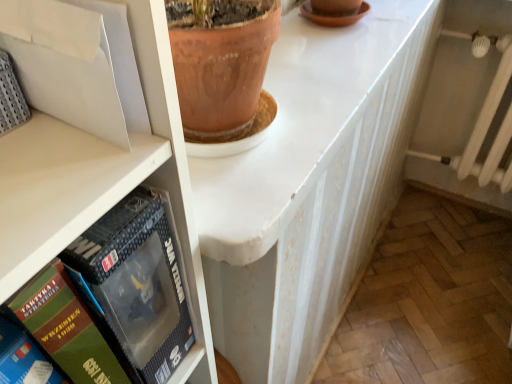
Identify the location of white glossy counter top at center. (294, 125).

The height and width of the screenshot is (384, 512). What do you see at coordinates (294, 125) in the screenshot?
I see `white glossy counter top at center` at bounding box center [294, 125].

Find the location of `green matte book at left, arranged as the 2th book when viewed from the left`. green matte book at left, arranged as the 2th book when viewed from the left is located at coordinates (64, 327).

Locate an element on the screen. green cardboard book at lower left, marked as the third book in a right-to-left arrangement is located at coordinates (23, 359).

Describe the element at coordinates (135, 285) in the screenshot. I see `matte black box at left, the first book viewed from the right` at that location.

Image resolution: width=512 pixels, height=384 pixels. What are the coordinates of `white glossy counter top at center` in the screenshot? It's located at (294, 125).

How many degrees apart are the facing directions of green matte book at left, the second book when ordered from right to left, and matte black box at left, which is the 3th book in left-to-right order?

2.6 degrees.

Is green matte book at left, the second book when ordered from right to left, in front of matte black box at left, which is the 3th book in left-to-right order?

Yes, green matte book at left, the second book when ordered from right to left, is closer to the camera.

Locate an element on the screen. Image resolution: width=512 pixels, height=384 pixels. the 1st book above the matte black box at left, which is the 3th book in left-to-right order (from a real-world perspective) is located at coordinates (64, 327).

Is green matte book at left, arranged as the 2th book when viewed from the left, positioned with its back to matte black box at left, the first book viewed from the right?

No, green matte book at left, arranged as the 2th book when viewed from the left,'s orientation is not away from matte black box at left, the first book viewed from the right.

Which object is closer to the camera taking this photo, green cardboard book at lower left, the 1th book from the left, or green matte book at left, the second book when ordered from right to left?

green matte book at left, the second book when ordered from right to left, is in front.

Is green cardboard book at lower left, the 1th book from the left, next to green matte book at left, the second book when ordered from right to left, and touching it?

Yes, green cardboard book at lower left, the 1th book from the left, is in contact with green matte book at left, the second book when ordered from right to left.

Is green matte book at left, arranged as the 2th book when viewed from the left, located within green cardboard book at lower left, marked as the third book in a right-to-left arrangement?

No, green cardboard book at lower left, marked as the third book in a right-to-left arrangement, does not contain green matte book at left, arranged as the 2th book when viewed from the left.

Is matte black box at left, which is the 3th book in left-to-right order, aimed at green matte book at left, the second book when ordered from right to left?

No.

From a real-world perspective, count 1st books upward from the matte black box at left, which is the 3th book in left-to-right order, and point to it. Please provide its 2D coordinates.

[(64, 327)]

Considering the positions of point (119, 243) and point (61, 302), is point (119, 243) closer or farther from the camera than point (61, 302)?

Point (119, 243) is positioned farther from the camera compared to point (61, 302).

Does matte black box at left, which is the 3th book in left-to-right order, appear on the right side of green matte book at left, the second book when ordered from right to left?

Yes, matte black box at left, which is the 3th book in left-to-right order, is to the right of green matte book at left, the second book when ordered from right to left.

Is white glossy counter top at center to the left or to the right of matte black box at left, the first book viewed from the right, in the image?

Clearly, white glossy counter top at center is on the right of matte black box at left, the first book viewed from the right, in the image.

Is white glossy counter top at center with matte black box at left, which is the 3th book in left-to-right order?

white glossy counter top at center and matte black box at left, which is the 3th book in left-to-right order, are clearly separated.

Who is shorter, white glossy counter top at center or matte black box at left, which is the 3th book in left-to-right order?

With less height is white glossy counter top at center.

How many degrees apart are the facing directions of white glossy counter top at center and matte black box at left, the first book viewed from the right?

83.3 degrees.

From the image's perspective, is green cardboard book at lower left, the 1th book from the left, positioned above or below white glossy counter top at center?

From the image's perspective, green cardboard book at lower left, the 1th book from the left, appears below white glossy counter top at center.

Is green cardboard book at lower left, marked as the third book in a right-to-left arrangement, not close to white glossy counter top at center?

Actually, green cardboard book at lower left, marked as the third book in a right-to-left arrangement, and white glossy counter top at center are a little close together.

Which of these two, green cardboard book at lower left, the 1th book from the left, or white glossy counter top at center, is thinner?

green cardboard book at lower left, the 1th book from the left.

Would you say green cardboard book at lower left, marked as the third book in a right-to-left arrangement, is to the left or to the right of white glossy counter top at center in the picture?

Based on their positions, green cardboard book at lower left, marked as the third book in a right-to-left arrangement, is located to the left of white glossy counter top at center.

Is green matte book at left, arranged as the 2th book when viewed from the left, far away from green cardboard book at lower left, marked as the third book in a right-to-left arrangement?

That's not correct — green matte book at left, arranged as the 2th book when viewed from the left, is a little close to green cardboard book at lower left, marked as the third book in a right-to-left arrangement.

Measure the distance from green matte book at left, the second book when ordered from right to left, to green cardboard book at lower left, the 1th book from the left.

green matte book at left, the second book when ordered from right to left, and green cardboard book at lower left, the 1th book from the left, are 1.08 inches apart from each other.

Is green matte book at left, the second book when ordered from right to left, oriented towards green cardboard book at lower left, marked as the third book in a right-to-left arrangement?

No, green matte book at left, the second book when ordered from right to left, does not turn towards green cardboard book at lower left, marked as the third book in a right-to-left arrangement.

Is green matte book at left, the second book when ordered from right to left, wider or thinner than green cardboard book at lower left, the 1th book from the left?

In the image, green matte book at left, the second book when ordered from right to left, appears to be wider than green cardboard book at lower left, the 1th book from the left.

Which is more to the right, matte black box at left, which is the 3th book in left-to-right order, or white glossy counter top at center?

Positioned to the right is white glossy counter top at center.

Is white glossy counter top at center located within matte black box at left, the first book viewed from the right?

No, matte black box at left, the first book viewed from the right, does not contain white glossy counter top at center.

From the image's perspective, is matte black box at left, which is the 3th book in left-to-right order, above white glossy counter top at center?

No, from the image's perspective, matte black box at left, which is the 3th book in left-to-right order, is not above white glossy counter top at center.

The image size is (512, 384). There is a matte black box at left, which is the 3th book in left-to-right order. Find the location of `the 2nd book below it (from the image's perspective)`. the 2nd book below it (from the image's perspective) is located at coordinates (64, 327).

This screenshot has height=384, width=512. Identify the location of book located above the green matte book at left, the second book when ordered from right to left (from a real-world perspective). (23, 359).

From the image, which object appears to be farther from green matte book at left, the second book when ordered from right to left, matte black box at left, the first book viewed from the right, or green cardboard book at lower left, the 1th book from the left?

matte black box at left, the first book viewed from the right, lies further to green matte book at left, the second book when ordered from right to left, than the other object.

Based on their spatial positions, is green cardboard book at lower left, the 1th book from the left, or green matte book at left, arranged as the 2th book when viewed from the left, closer to matte black box at left, the first book viewed from the right?

Based on the image, green matte book at left, arranged as the 2th book when viewed from the left, appears to be nearer to matte black box at left, the first book viewed from the right.

Considering their positions, is green cardboard book at lower left, the 1th book from the left, positioned further to white glossy counter top at center than matte black box at left, the first book viewed from the right?

green cardboard book at lower left, the 1th book from the left, is further to white glossy counter top at center.

Considering their positions, is green matte book at left, the second book when ordered from right to left, positioned further to white glossy counter top at center than green cardboard book at lower left, the 1th book from the left?

The object further to white glossy counter top at center is green cardboard book at lower left, the 1th book from the left.

Estimate the real-world distances between objects in this image. Which object is closer to green cardboard book at lower left, marked as the third book in a right-to-left arrangement, green matte book at left, arranged as the 2th book when viewed from the left, or white glossy counter top at center?

Based on the image, green matte book at left, arranged as the 2th book when viewed from the left, appears to be nearer to green cardboard book at lower left, marked as the third book in a right-to-left arrangement.

Which object lies further to the anchor point green matte book at left, the second book when ordered from right to left, matte black box at left, the first book viewed from the right, or white glossy counter top at center?

white glossy counter top at center.

When comparing their distances from white glossy counter top at center, does matte black box at left, the first book viewed from the right, or green cardboard book at lower left, marked as the third book in a right-to-left arrangement, seem further?

The object further to white glossy counter top at center is green cardboard book at lower left, marked as the third book in a right-to-left arrangement.

Estimate the real-world distances between objects in this image. Which object is further from matte black box at left, the first book viewed from the right, green cardboard book at lower left, the 1th book from the left, or white glossy counter top at center?

white glossy counter top at center.

The width and height of the screenshot is (512, 384). In order to click on book between green cardboard book at lower left, the 1th book from the left, and matte black box at left, the first book viewed from the right, in the horizontal direction in this screenshot , I will do `click(64, 327)`.

You are a GUI agent. You are given a task and a screenshot of the screen. Output one action in this format:
    pyautogui.click(x=<x>, y=<y>)
    Task: Click on the book that lies between white glossy counter top at center and green cardboard book at lower left, marked as the third book in a right-to-left arrangement, from top to bottom
    The width and height of the screenshot is (512, 384).
    Given the screenshot: What is the action you would take?
    pyautogui.click(x=135, y=285)